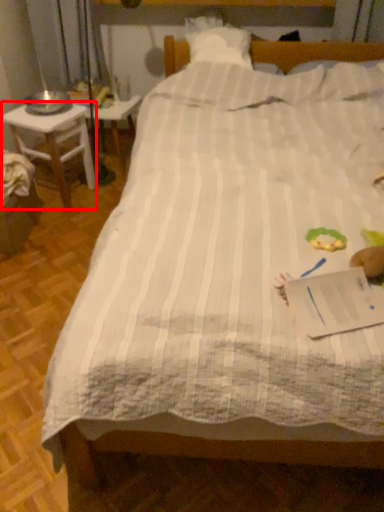
Question: From the image's perspective, considering the relative positions of desk (annotated by the red box) and table in the image provided, where is desk (annotated by the red box) located with respect to the staircase?

Choices:
 (A) below
 (B) above

Answer: (A)